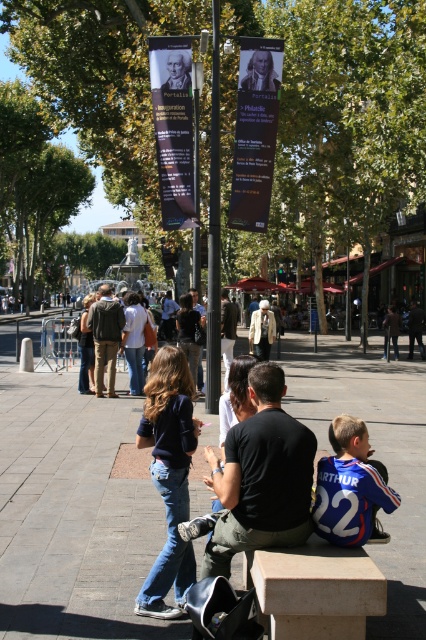
Looking at this image, you are a delivery person carrying a large box that is 1.2 meters wide. You need to walk through the area shown in the image. Can the gray concrete pavement at center accommodate your box without hitting the light brown leather jacket at center?

The gray concrete pavement at center is wider than the light brown leather jacket at center, so the 1.2 meter wide box can pass through without hitting the light brown leather jacket at center as long as it stays on the gray concrete pavement at center.